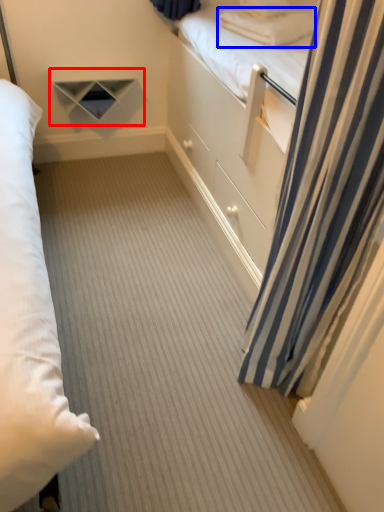
Question: Which point is closer to the camera, shelf (highlighted by a red box) or pillow (highlighted by a blue box)?

Choices:
 (A) shelf
 (B) pillow

Answer: (B)